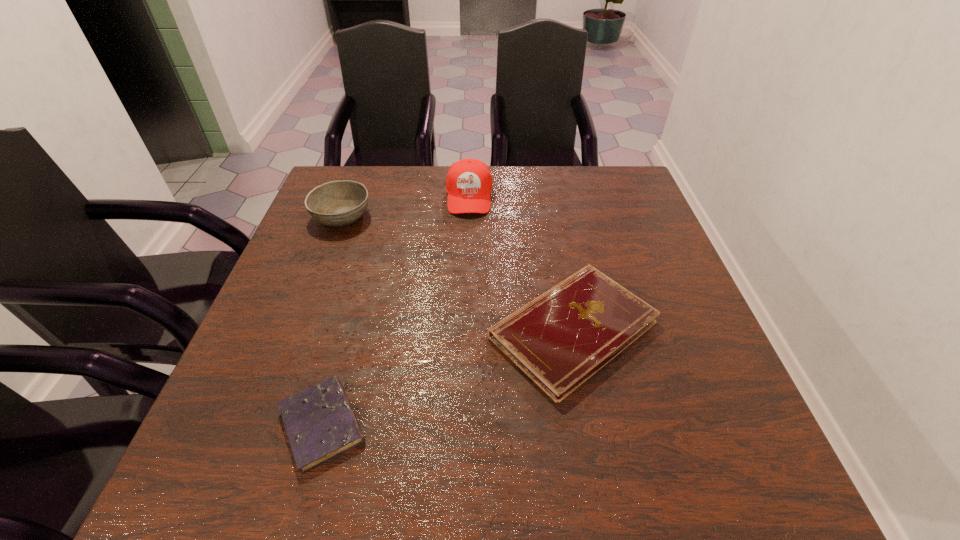
Where is `baseball cap`? The image size is (960, 540). baseball cap is located at coordinates (469, 182).

Find the location of `bowl`. bowl is located at coordinates (337, 203).

Where is `the third tallest object`? the third tallest object is located at coordinates tap(560, 339).

Locate an element on the screen. This screenshot has height=540, width=960. diary is located at coordinates (320, 423).

The width and height of the screenshot is (960, 540). Identify the location of vacant area situated on the front panel of the tallest object. (467, 280).

Identify the location of free space located 0.060m on the front of the bowl. The width and height of the screenshot is (960, 540). (329, 249).

I want to click on blank area located 0.190m on the left of the notebook, so click(396, 329).

In order to click on vacant region located on the back of the shortest object in this screenshot , I will do `click(363, 278)`.

The width and height of the screenshot is (960, 540). What are the coordinates of `baseball cap at the far edge` in the screenshot? It's located at (469, 182).

The image size is (960, 540). Find the location of `bowl situated at the far edge`. bowl situated at the far edge is located at coordinates (337, 203).